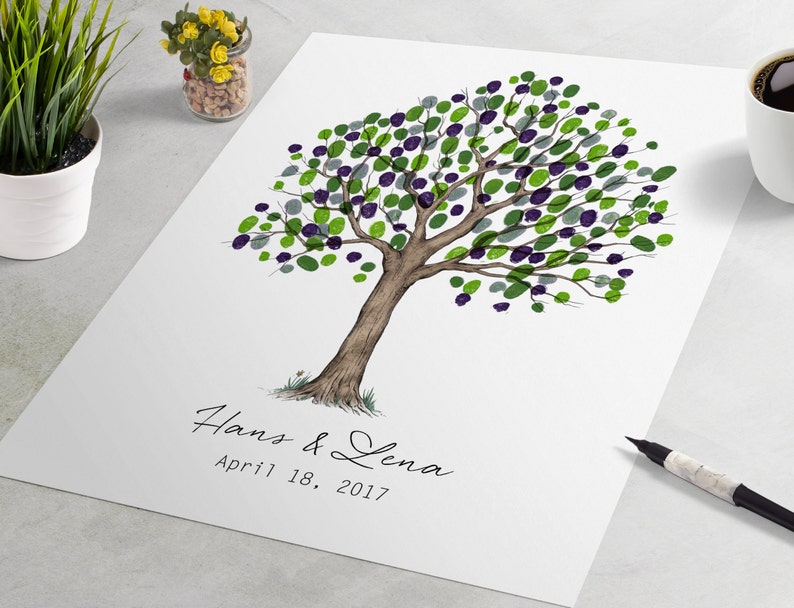
Image resolution: width=794 pixels, height=608 pixels. Identify the location of pot. (37, 223).